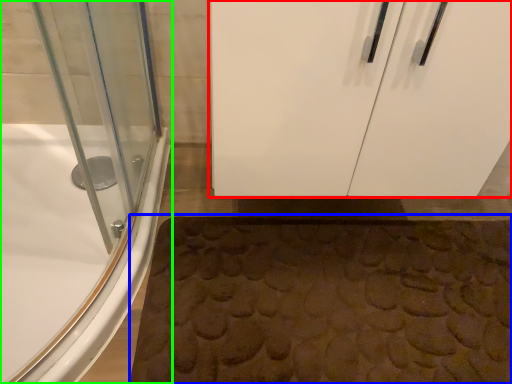
Question: Considering the real-world distances, which object is farthest from door (highlighted by a red box)? bath mat (highlighted by a blue box) or bathtub (highlighted by a green box)?

Choices:
 (A) bath mat
 (B) bathtub

Answer: (B)